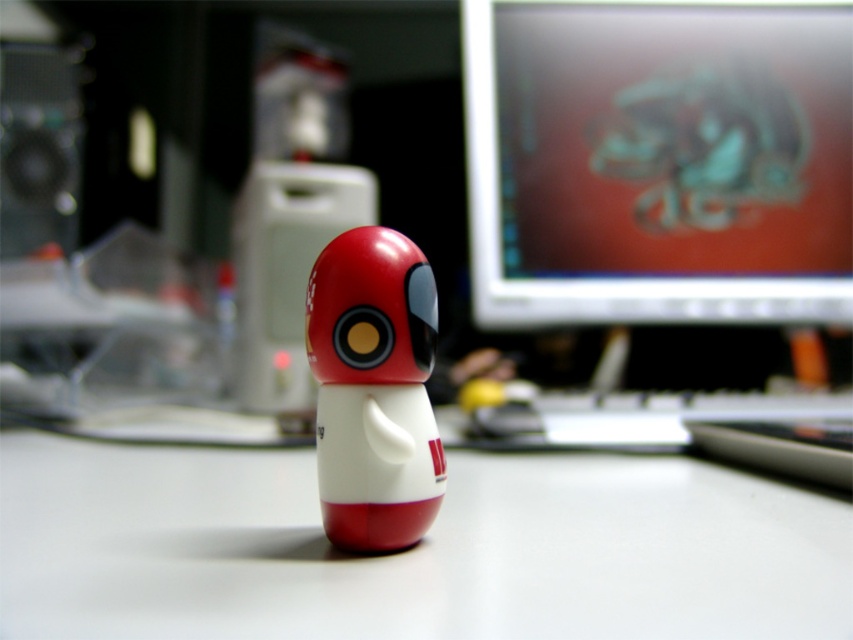
Can you confirm if white matte computer desk at center is positioned to the left of matte plastic toy at center?

Indeed, white matte computer desk at center is positioned on the left side of matte plastic toy at center.

Where is `white matte computer desk at center`? The image size is (853, 640). white matte computer desk at center is located at coordinates (410, 548).

Find the location of `white matte computer desk at center`. white matte computer desk at center is located at coordinates (x=410, y=548).

Between point (666, 244) and point (321, 352), which one is positioned in front?

Point (321, 352) is more forward.

Find the location of a particular element. The width and height of the screenshot is (853, 640). matte plastic monitor at upper right is located at coordinates (659, 161).

Image resolution: width=853 pixels, height=640 pixels. I want to click on matte plastic monitor at upper right, so click(659, 161).

Is white matte computer desk at center thinner than matte plastic monitor at upper right?

In fact, white matte computer desk at center might be wider than matte plastic monitor at upper right.

Is white matte computer desk at center positioned behind matte plastic monitor at upper right?

No, white matte computer desk at center is closer to the viewer.

The image size is (853, 640). Find the location of `white matte computer desk at center`. white matte computer desk at center is located at coordinates (410, 548).